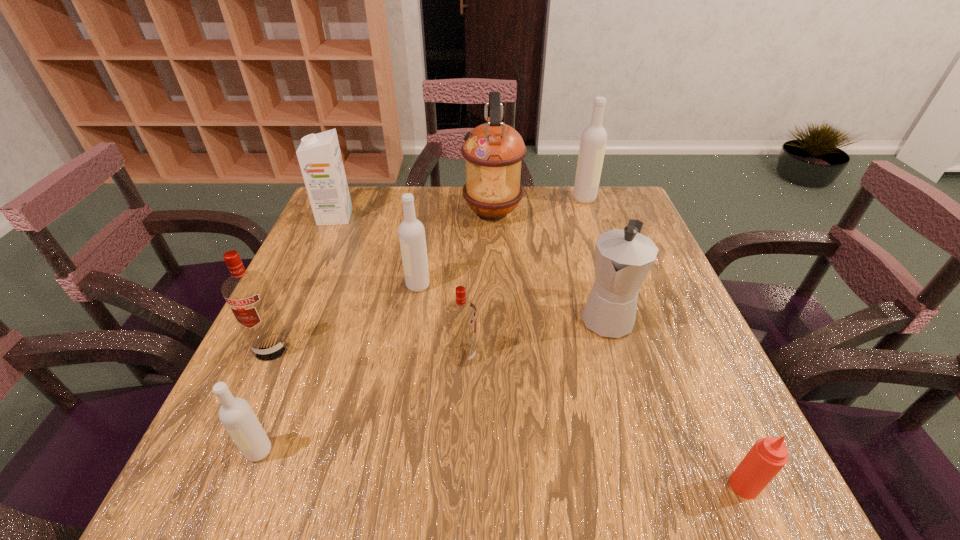
The height and width of the screenshot is (540, 960). In order to click on free space between the gray coffeepot and the carton in this screenshot , I will do `click(470, 267)`.

Identify which object is located as the eighth nearest to the oil lamp. Please provide its 2D coordinates. Your answer should be formatted as a tuple, i.e. [(x, y)], where the tuple contains the x and y coordinates of a point satisfying the conditions above.

[(769, 455)]

Choose which object is the fifth nearest neighbor to the gray coffeepot. Please provide its 2D coordinates. Your answer should be formatted as a tuple, i.e. [(x, y)], where the tuple contains the x and y coordinates of a point satisfying the conditions above.

[(593, 141)]

In order to click on vodka that is the third nearest to the coffeepot in this screenshot , I will do 593,141.

Find the location of a particular element. Image resolution: width=960 pixels, height=540 pixels. vodka identified as the third closest to the farthest vodka is located at coordinates (247, 293).

Locate which white vodka is the closest to the oil lamp. Please provide its 2D coordinates. Your answer should be formatted as a tuple, i.e. [(x, y)], where the tuple contains the x and y coordinates of a point satisfying the conditions above.

[(593, 141)]

In order to click on white vodka that can be found as the closest to the farthest vodka in this screenshot , I will do `click(411, 231)`.

Identify the location of vacant space that satisfies the following two spatial constraints: 1. on the back side of the tallest vodka; 2. on the left side of the oil lamp. (492, 199).